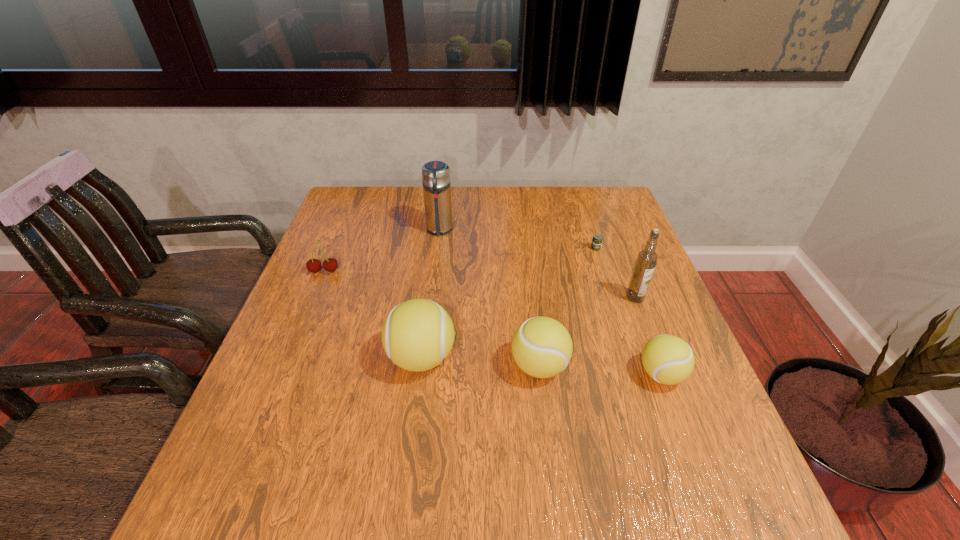
Where is `the fifth shortest object`? This screenshot has height=540, width=960. the fifth shortest object is located at coordinates (417, 335).

The height and width of the screenshot is (540, 960). In order to click on the tallest tennis ball in this screenshot , I will do `click(417, 335)`.

The height and width of the screenshot is (540, 960). Find the location of `the second shortest tennis ball`. the second shortest tennis ball is located at coordinates (542, 347).

The width and height of the screenshot is (960, 540). I want to click on the fourth object from right to left, so click(542, 347).

Where is `the rightmost tennis ball`? The height and width of the screenshot is (540, 960). the rightmost tennis ball is located at coordinates (667, 359).

Locate an element on the screen. cherry is located at coordinates (313, 265).

This screenshot has width=960, height=540. Identify the location of the leftmost object. (313, 265).

Find the location of a particular element. This screenshot has width=960, height=540. thermos bottle is located at coordinates (436, 182).

Locate an element on the screen. the shortest object is located at coordinates (597, 239).

Find the location of a particular element. the second farthest object is located at coordinates (597, 239).